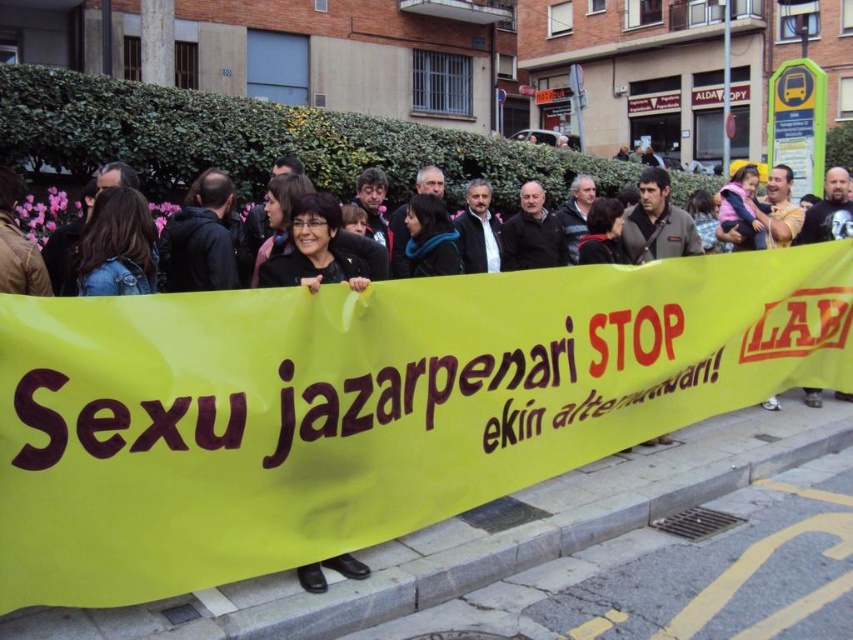
What do you see at coordinates (364, 406) in the screenshot? I see `yellow fabric banner at center` at bounding box center [364, 406].

Which is in front, point (270, 333) or point (395, 259)?

Point (270, 333)

Between point (711, 356) and point (44, 218), which one is positioned in front?

Positioned in front is point (711, 356).

Locate an element on the screen. The image size is (853, 640). yellow fabric banner at center is located at coordinates (364, 406).

Between matte black jacket at center and black fabric crowd at center, which one appears on the left side from the viewer's perspective?

Positioned to the left is matte black jacket at center.

Does matte black jacket at center have a greater width compared to black fabric crowd at center?

No, matte black jacket at center is not wider than black fabric crowd at center.

What do you see at coordinates (314, 250) in the screenshot? I see `matte black jacket at center` at bounding box center [314, 250].

What are the coordinates of `matte black jacket at center` in the screenshot? It's located at (314, 250).

Who is positioned more to the left, yellow fabric banner at center or matte black jacket at center?

Positioned to the left is matte black jacket at center.

Between yellow fabric banner at center and matte black jacket at center, which one is positioned lower?

yellow fabric banner at center is below.

Who is more forward, (155,429) or (354,275)?

Point (155,429) is in front.

Find the location of a particular element. Image resolution: width=853 pixels, height=640 pixels. yellow fabric banner at center is located at coordinates (364, 406).